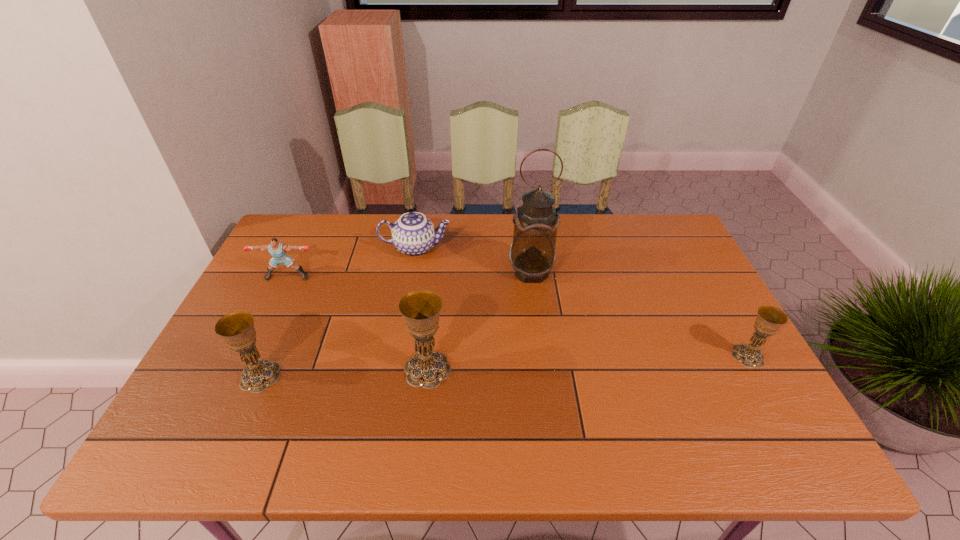
If equal spacing is desired by inserting an extra chalice among them, please point out a free spot for this new chalice. Please provide its 2D coordinates. Your answer should be formatted as a tuple, i.e. [(x, y)], where the tuple contains the x and y coordinates of a point satisfying the conditions above.

[(590, 362)]